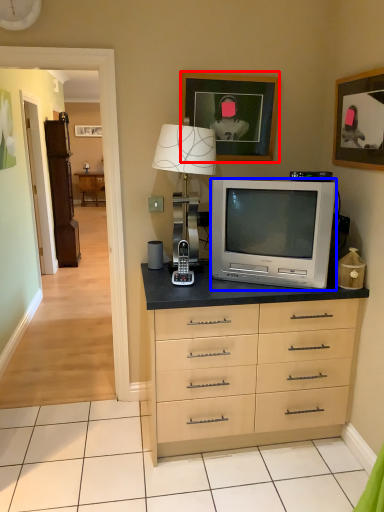
Question: Which object is further to the camera taking this photo, picture frame (highlighted by a red box) or television (highlighted by a blue box)?

Choices:
 (A) picture frame
 (B) television

Answer: (A)